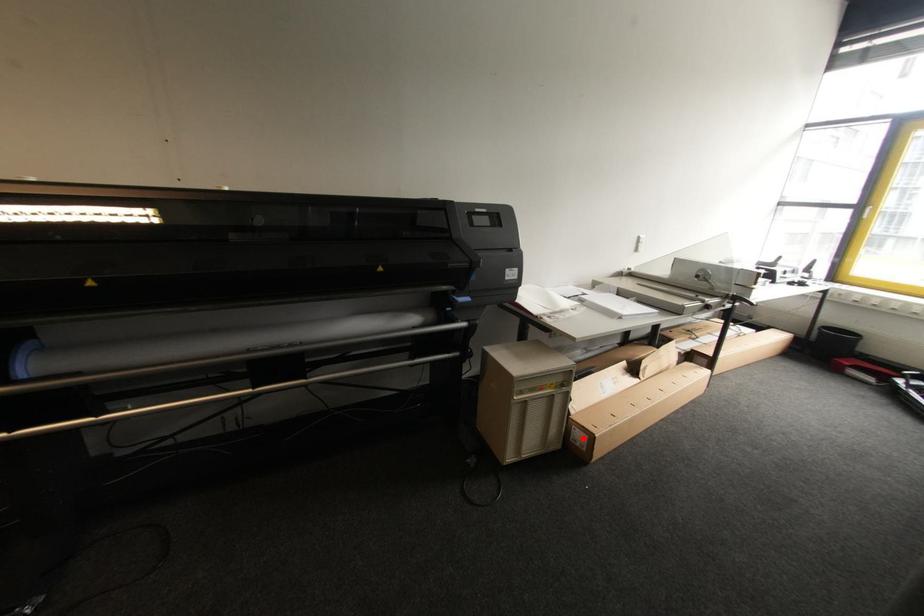
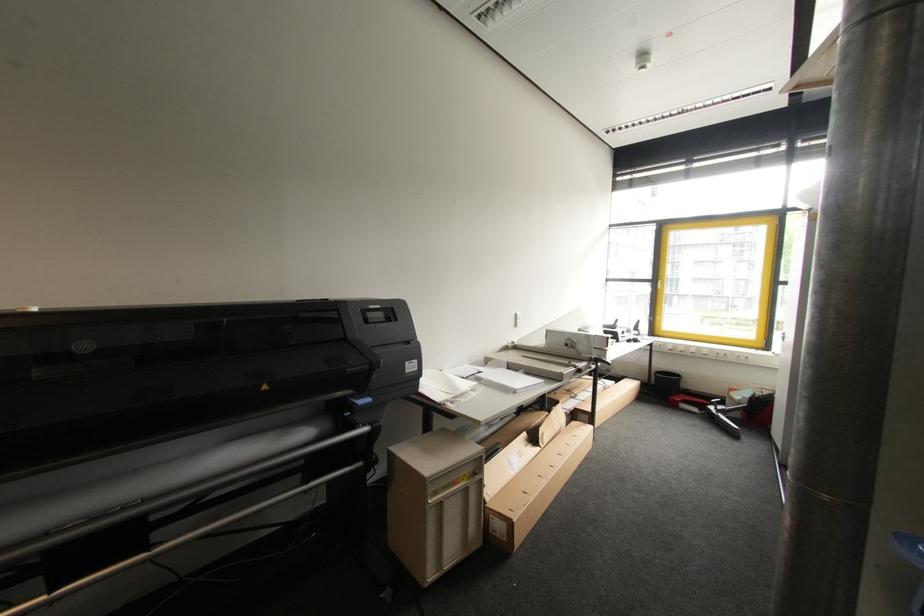
The point at the highlighted location is marked in the first image. Where is the corresponding point in the second image?

(503, 527)